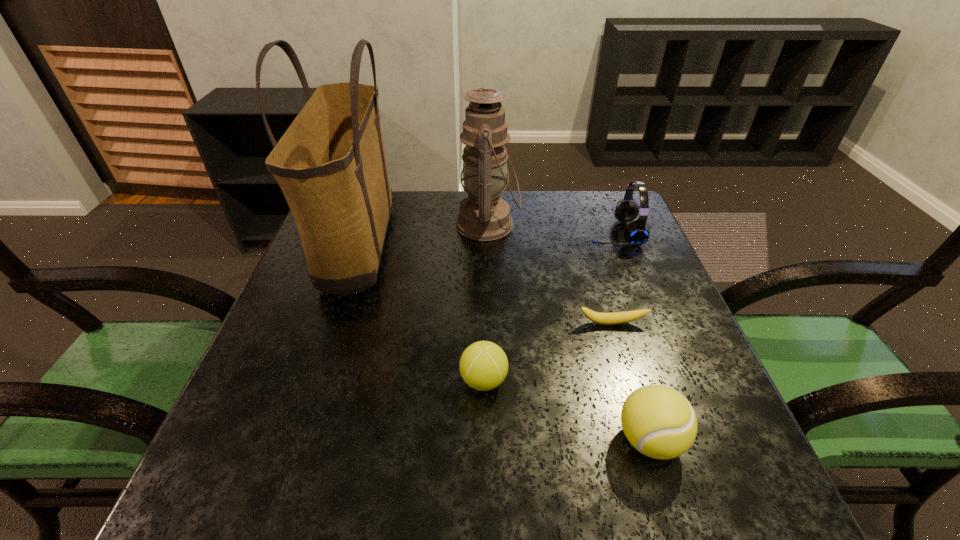
This screenshot has width=960, height=540. Identify the location of tote bag. (330, 164).

At what (x,y) coordinates should I click in order to perform the action: click on the leftmost object. Please return your answer as a coordinate pair (x, y). Looking at the image, I should click on click(330, 164).

Where is `oil lamp`? This screenshot has width=960, height=540. oil lamp is located at coordinates (484, 215).

Image resolution: width=960 pixels, height=540 pixels. Find the location of `the fourth shortest object`. the fourth shortest object is located at coordinates (636, 233).

Where is `the fourth tallest object`? the fourth tallest object is located at coordinates (658, 421).

Where is `the nearest object`? Image resolution: width=960 pixels, height=540 pixels. the nearest object is located at coordinates (658, 421).

This screenshot has height=540, width=960. What are the coordinates of `the shorter tennis ball` in the screenshot? It's located at (483, 365).

The width and height of the screenshot is (960, 540). I want to click on the second nearest object, so click(x=483, y=365).

Find the location of `the third nearest object`. the third nearest object is located at coordinates (615, 318).

At what (x,y) coordinates should I click in order to perform the action: click on banana. Please return your answer as a coordinate pair (x, y). The image size is (960, 540). Looking at the image, I should click on (615, 318).